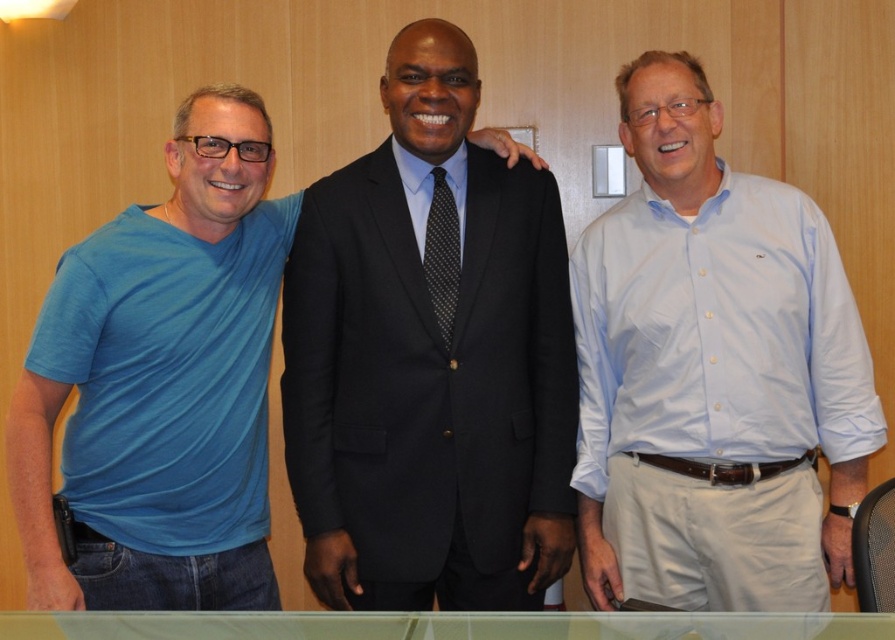
Question: Among these points, which one is farthest from the camera?

Choices:
 (A) (666, 173)
 (B) (250, 410)

Answer: (A)

Question: Which object appears closest to the camera in this image?

Choices:
 (A) black wool suit at center
 (B) blue t-shirt at left
 (C) black dotted tie at center

Answer: (B)

Question: Which point is farther from the camera taking this photo?

Choices:
 (A) (263, 552)
 (B) (580, 545)

Answer: (B)

Question: Is light blue button-down shirt at center to the left of blue t-shirt at left from the viewer's perspective?

Choices:
 (A) no
 (B) yes

Answer: (A)

Question: Can you confirm if light blue button-down shirt at center is positioned above blue t-shirt at left?

Choices:
 (A) yes
 (B) no

Answer: (A)

Question: Is black wool suit at center below black dotted tie at center?

Choices:
 (A) no
 (B) yes

Answer: (B)